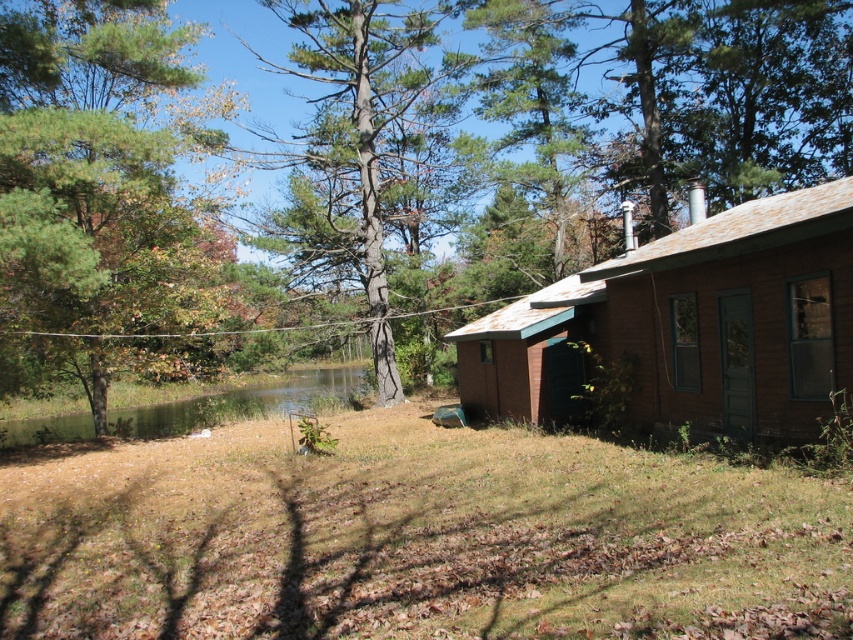
Based on the photo, does green leafy tree at center appear on the left side of brown wooden cabin at right?

Correct, you'll find green leafy tree at center to the left of brown wooden cabin at right.

Who is taller, green leafy tree at center or brown wooden cabin at right?

Standing taller between the two is green leafy tree at center.

Find the location of a particular element. green leafy tree at center is located at coordinates (579, 193).

I want to click on green leafy tree at center, so click(579, 193).

Between point (810, 346) and point (219, 132), which one is positioned in front?

Positioned in front is point (810, 346).

Which is behind, point (436, 189) or point (126, 81)?

Positioned behind is point (436, 189).

Find the location of a particular element. The width and height of the screenshot is (853, 640). green leafy tree at center is located at coordinates (579, 193).

Who is positioned more to the right, green leafy tree at left or brown wooden cabin at right?

From the viewer's perspective, brown wooden cabin at right appears more on the right side.

Looking at this image, does green leafy tree at left have a lesser height compared to brown wooden cabin at right?

In fact, green leafy tree at left may be taller than brown wooden cabin at right.

Find the location of a particular element. green leafy tree at left is located at coordinates (102, 193).

The image size is (853, 640). Find the location of `green leafy tree at left`. green leafy tree at left is located at coordinates (102, 193).